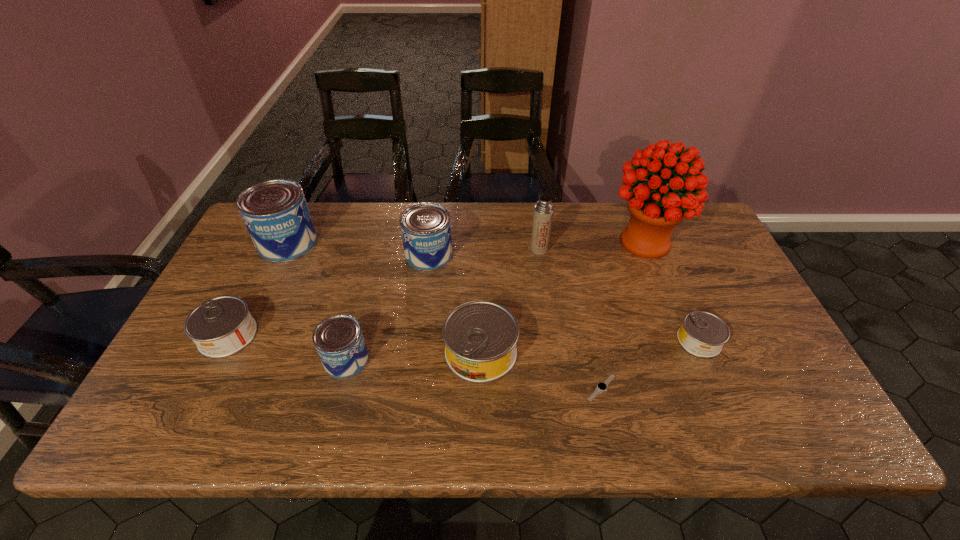
Find the location of a particular element. The height and width of the screenshot is (540, 960). the closest blue can to the tallest can is located at coordinates click(425, 227).

This screenshot has height=540, width=960. What are the coordinates of `blue can that can be found as the third closest to the watch` in the screenshot? It's located at (275, 212).

Where is `the closest silver can relative to the nearest blue can`? Image resolution: width=960 pixels, height=540 pixels. the closest silver can relative to the nearest blue can is located at coordinates (480, 337).

Image resolution: width=960 pixels, height=540 pixels. Find the location of `silver can that is the second closest to the leftmost silver can`. silver can that is the second closest to the leftmost silver can is located at coordinates (702, 334).

Find the location of `vacant area that satisfies the following two spatial constraints: 1. on the front label of the watch; 2. on the right side of the tallest can`. vacant area that satisfies the following two spatial constraints: 1. on the front label of the watch; 2. on the right side of the tallest can is located at coordinates (220, 388).

At what (x,y) coordinates should I click in order to perform the action: click on free point that satisfies the following two spatial constraints: 1. on the front label of the fifth shortest can; 2. on the left side of the shortest object. Please return your answer as a coordinate pair (x, y). Looking at the image, I should click on (413, 388).

You are a GUI agent. You are given a task and a screenshot of the screen. Output one action in this format:
    pyautogui.click(x=<x>, y=<y>)
    Task: Click on the vacant space that satisfies the following two spatial constraints: 1. on the front side of the watch; 2. on the left side of the second silver can from right to left
    The image size is (960, 540).
    Given the screenshot: What is the action you would take?
    pyautogui.click(x=481, y=388)

Image resolution: width=960 pixels, height=540 pixels. What are the coordinates of `free spot that satisfies the following two spatial constraints: 1. on the front label of the sixth shortest object; 2. on the front label of the fourth can from right to left` in the screenshot? It's located at click(x=416, y=360).